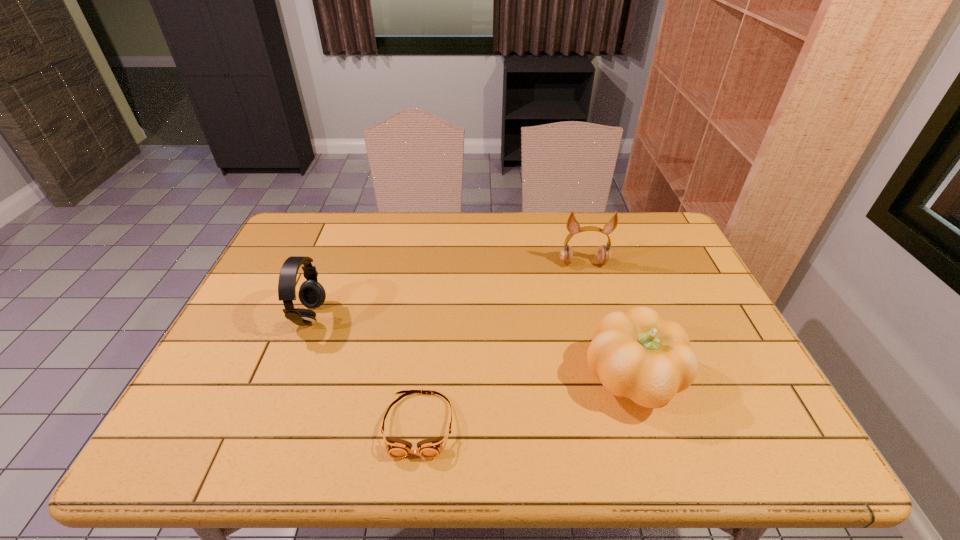
Locate an element on the screen. This screenshot has width=960, height=540. free space that satisfies the following two spatial constraints: 1. on the front-facing side of the farther earphone; 2. on the ear cups of the left earphone is located at coordinates (599, 317).

Locate an element on the screen. This screenshot has height=540, width=960. vacant space that satisfies the following two spatial constraints: 1. on the front-facing side of the farthest object; 2. on the left side of the pumpkin is located at coordinates (616, 379).

The width and height of the screenshot is (960, 540). What are the coordinates of `blank space that satisfies the following two spatial constraints: 1. on the front-facing side of the pumpkin; 2. on the right side of the farthest object` in the screenshot? It's located at (616, 379).

Find the location of a particular element. Image resolution: width=960 pixels, height=540 pixels. free spot that satisfies the following two spatial constraints: 1. on the ear cups of the pumpkin; 2. on the left side of the nearer earphone is located at coordinates (285, 379).

I want to click on free location that satisfies the following two spatial constraints: 1. on the ear cups of the left earphone; 2. on the back side of the pumpkin, so click(285, 379).

Find the location of a particular element. The height and width of the screenshot is (540, 960). free space that satisfies the following two spatial constraints: 1. on the front-facing side of the farthest object; 2. on the ear cups of the leftmost object is located at coordinates (599, 317).

The height and width of the screenshot is (540, 960). I want to click on free space that satisfies the following two spatial constraints: 1. on the ear cups of the leftmost object; 2. on the back side of the pumpkin, so click(285, 379).